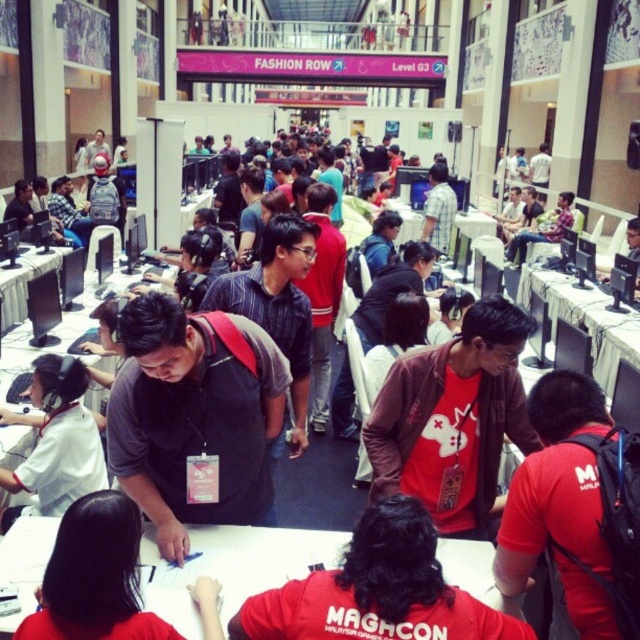
Is point (166, 380) positioned behind point (13, 481)?

Yes, point (166, 380) is farther from viewer.

What do you see at coordinates (193, 416) in the screenshot? I see `dark gray shirt at center` at bounding box center [193, 416].

This screenshot has width=640, height=640. Identify the location of dark gray shirt at center. (193, 416).

Is dark gray shirt at center below black plastic table at center?

Correct, dark gray shirt at center is located below black plastic table at center.

Can you confirm if dark gray shirt at center is bigger than black plastic table at center?

No, dark gray shirt at center is not bigger than black plastic table at center.

Image resolution: width=640 pixels, height=640 pixels. Find the location of `dark gray shirt at center`. dark gray shirt at center is located at coordinates (193, 416).

Who is positioned more to the left, matte black shirt at lower left or black plastic table at center?

Positioned to the left is matte black shirt at lower left.

How distant is matte black shirt at lower left from black plastic table at center?

matte black shirt at lower left and black plastic table at center are 14.13 meters apart from each other.

Find the location of a particular element. This screenshot has height=640, width=640. matte black shirt at lower left is located at coordinates (93, 577).